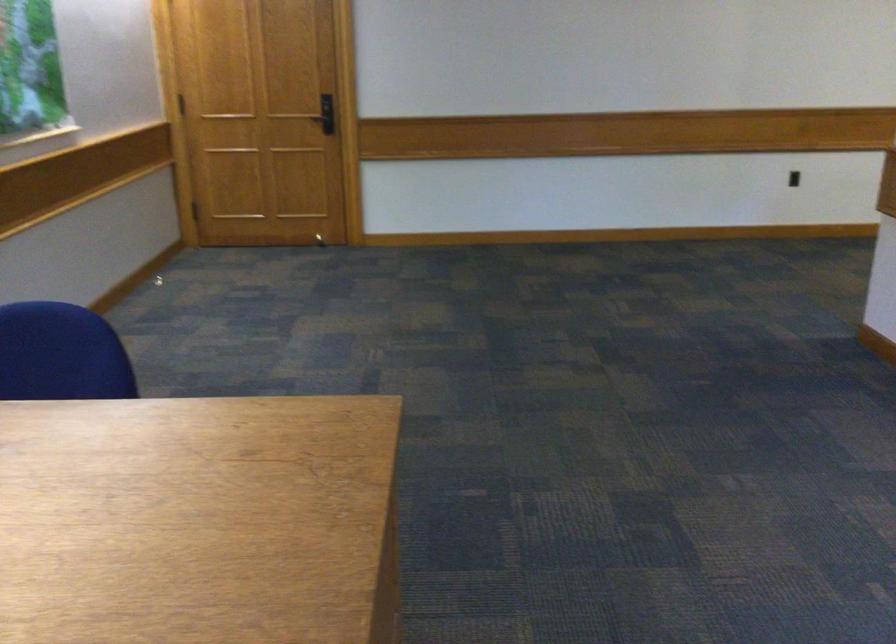
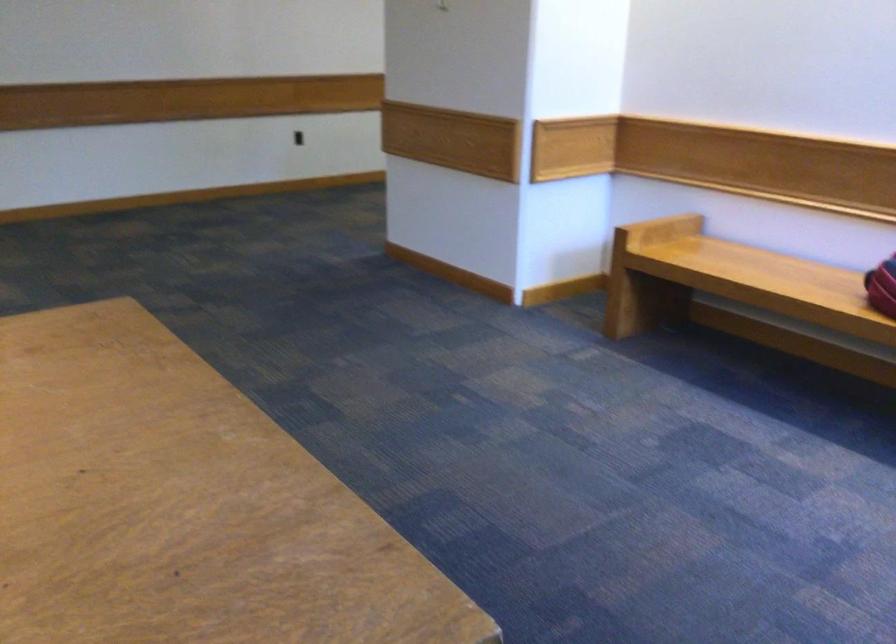
The images are taken continuously from a first-person perspective. In which direction are you moving?

The cameraman moved toward left, backward.